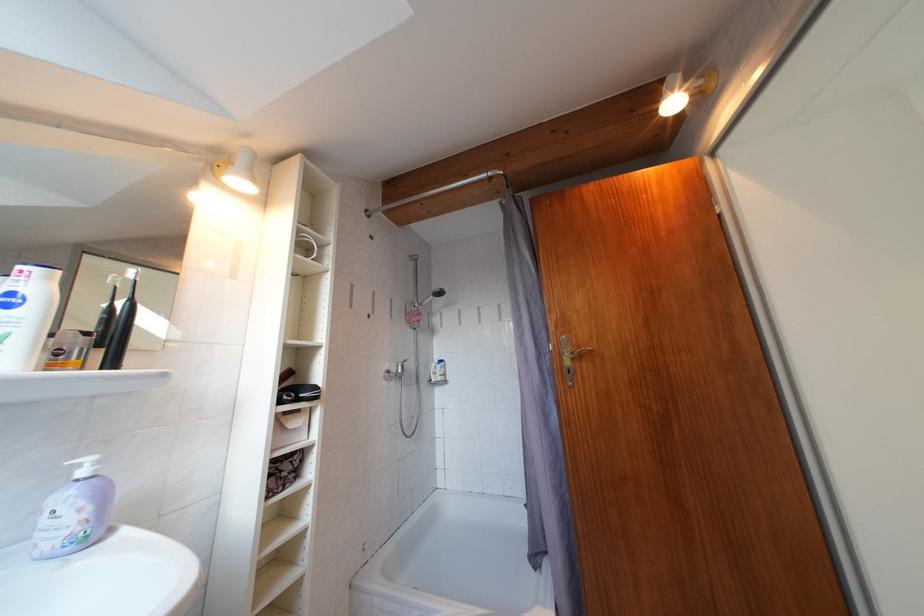
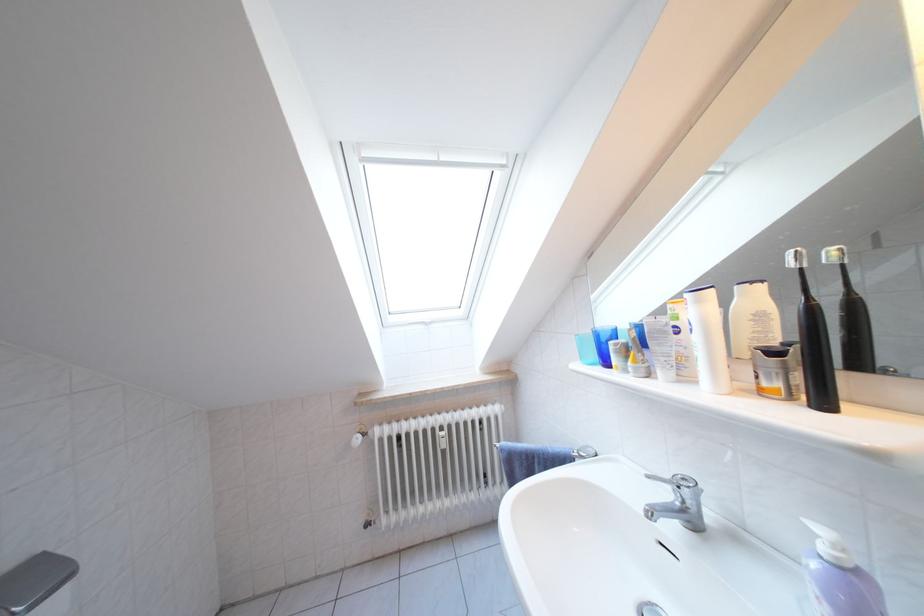
Question: I am providing you with two images of the same scene from different viewpoints. Which of the following objects are not visible in image2?

Choices:
 (A) silver deodorant can
 (B) white plastic bottle
 (C) black toothbrush
 (D) none of these

Answer: (D)